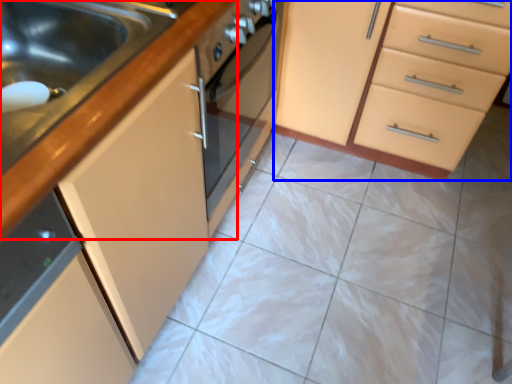
Question: Which object is further to the camera taking this photo, countertop (highlighted by a red box) or cabinetry (highlighted by a blue box)?

Choices:
 (A) countertop
 (B) cabinetry

Answer: (B)